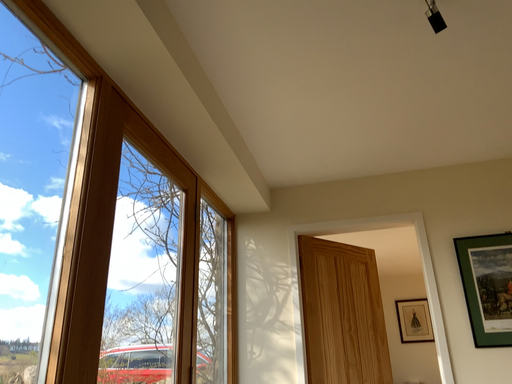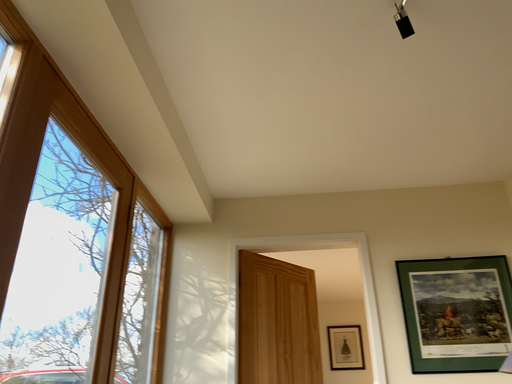
Question: Which way did the camera rotate in the video?

Choices:
 (A) rotated right
 (B) rotated left

Answer: (A)